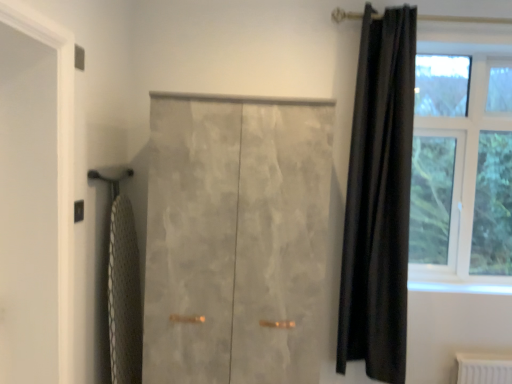
Question: Should I look upward or downward to see black velvet curtain at right?

Choices:
 (A) up
 (B) down

Answer: (B)

Question: Can we say white mesh bath towel at left lies outside clear glass window at upper right?

Choices:
 (A) no
 (B) yes

Answer: (B)

Question: Is white mesh bath towel at left facing away from clear glass window at upper right?

Choices:
 (A) no
 (B) yes

Answer: (A)

Question: Considering the relative sizes of white mesh bath towel at left and clear glass window at upper right in the image provided, is white mesh bath towel at left taller than clear glass window at upper right?

Choices:
 (A) no
 (B) yes

Answer: (A)

Question: Does white mesh bath towel at left appear on the left side of clear glass window at upper right?

Choices:
 (A) no
 (B) yes

Answer: (B)

Question: Considering the relative positions of white mesh bath towel at left and clear glass window at upper right in the image provided, is white mesh bath towel at left behind clear glass window at upper right?

Choices:
 (A) yes
 (B) no

Answer: (B)

Question: Does white mesh bath towel at left have a larger size compared to clear glass window at upper right?

Choices:
 (A) yes
 (B) no

Answer: (B)

Question: Is black velvet curtain at right next to white matte screen door at left and touching it?

Choices:
 (A) no
 (B) yes

Answer: (A)

Question: Can you confirm if black velvet curtain at right is wider than white matte screen door at left?

Choices:
 (A) no
 (B) yes

Answer: (A)

Question: Considering the relative sizes of black velvet curtain at right and white matte screen door at left in the image provided, is black velvet curtain at right taller than white matte screen door at left?

Choices:
 (A) yes
 (B) no

Answer: (A)

Question: Considering the relative positions of black velvet curtain at right and white matte screen door at left in the image provided, is black velvet curtain at right in front of white matte screen door at left?

Choices:
 (A) no
 (B) yes

Answer: (A)

Question: Can you confirm if black velvet curtain at right is shorter than white matte screen door at left?

Choices:
 (A) no
 (B) yes

Answer: (A)

Question: Is black velvet curtain at right far from white matte screen door at left?

Choices:
 (A) yes
 (B) no

Answer: (A)

Question: Can you confirm if clear glass window at upper right is thinner than white mesh bath towel at left?

Choices:
 (A) no
 (B) yes

Answer: (A)